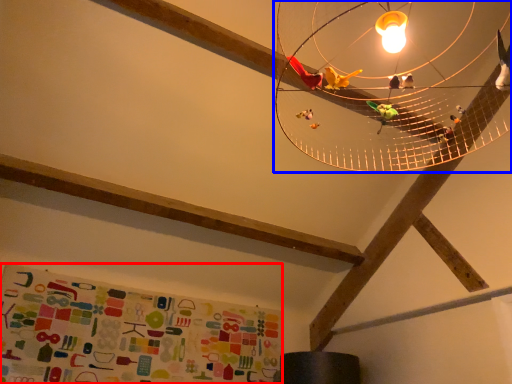
Question: Which of the following is the closest to the observer, bulletin board (highlighted by a red box) or lamp (highlighted by a blue box)?

Choices:
 (A) bulletin board
 (B) lamp

Answer: (B)